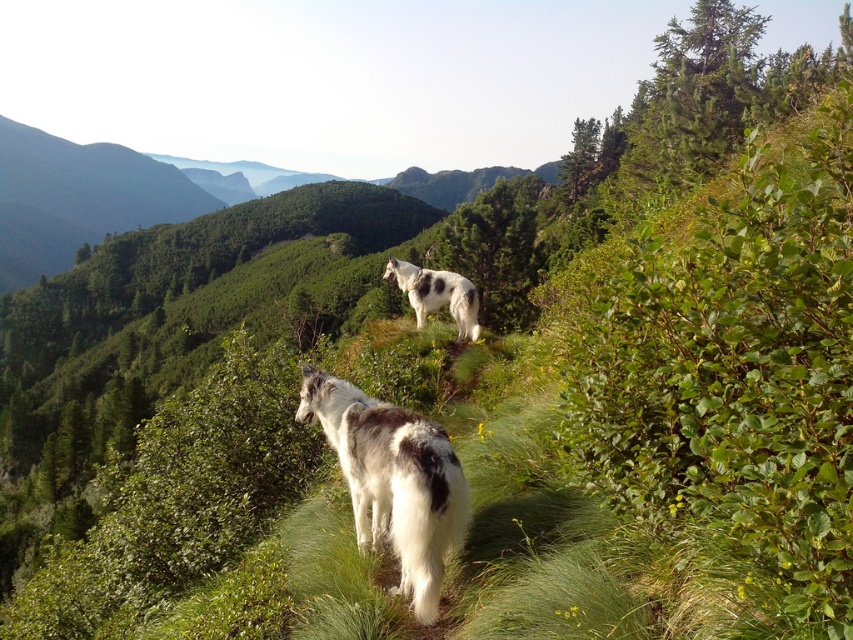
Is white woolen pony at center to the left of white speckled fur pony at center from the viewer's perspective?

Yes, white woolen pony at center is to the left of white speckled fur pony at center.

Is the position of white woolen pony at center less distant than that of white speckled fur pony at center?

Yes, it is in front of white speckled fur pony at center.

Identify the location of white woolen pony at center. (393, 481).